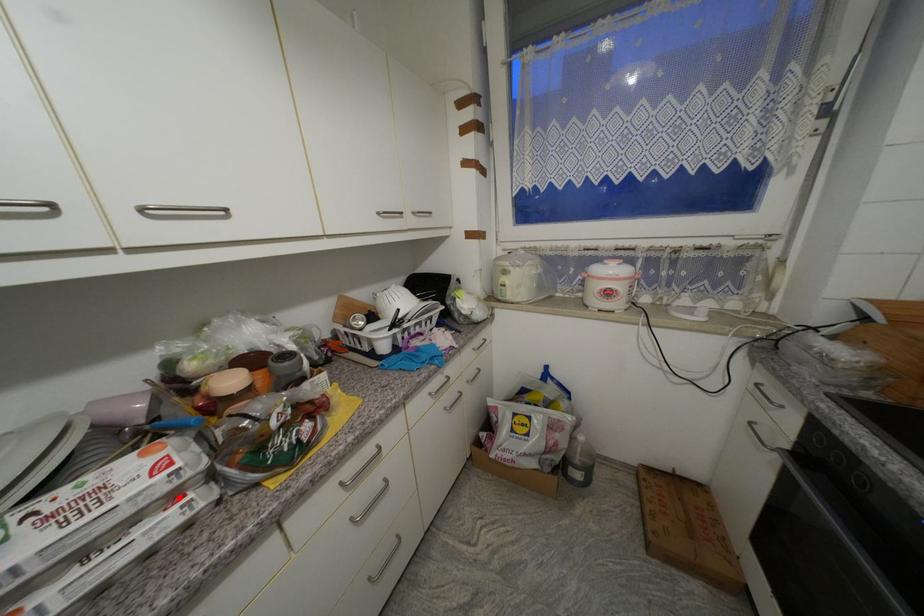
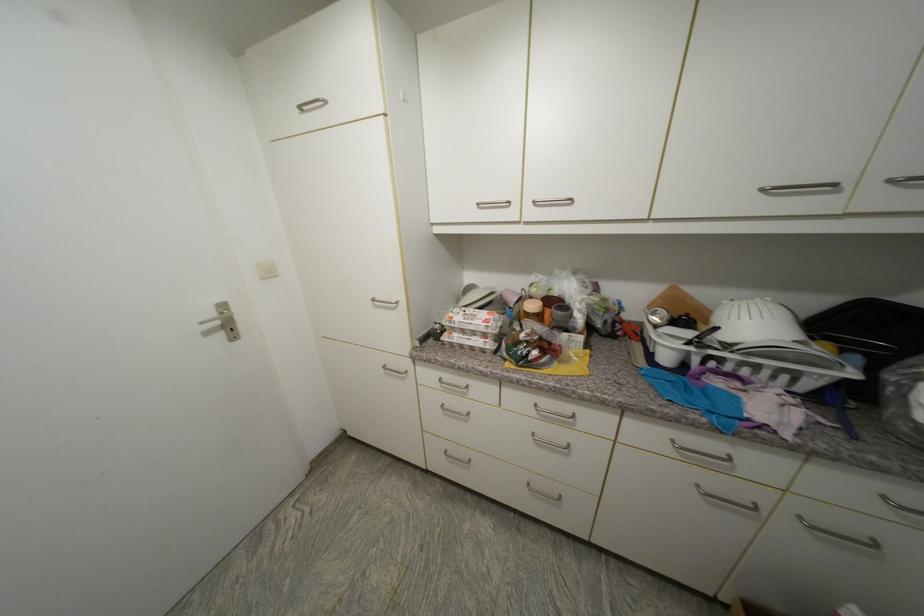
Find the pixel in the second image that matches the highlighted location in the first image.

(490, 337)